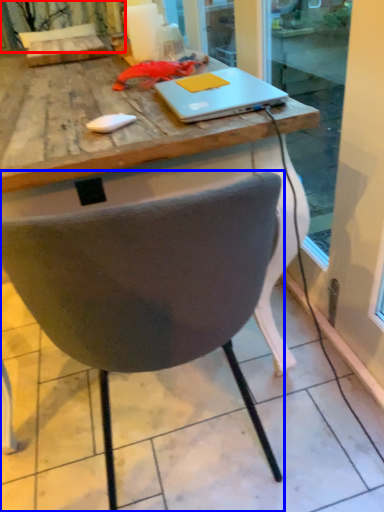
Question: Which object is further to the camera taking this photo, curtain (highlighted by a red box) or chair (highlighted by a blue box)?

Choices:
 (A) curtain
 (B) chair

Answer: (A)